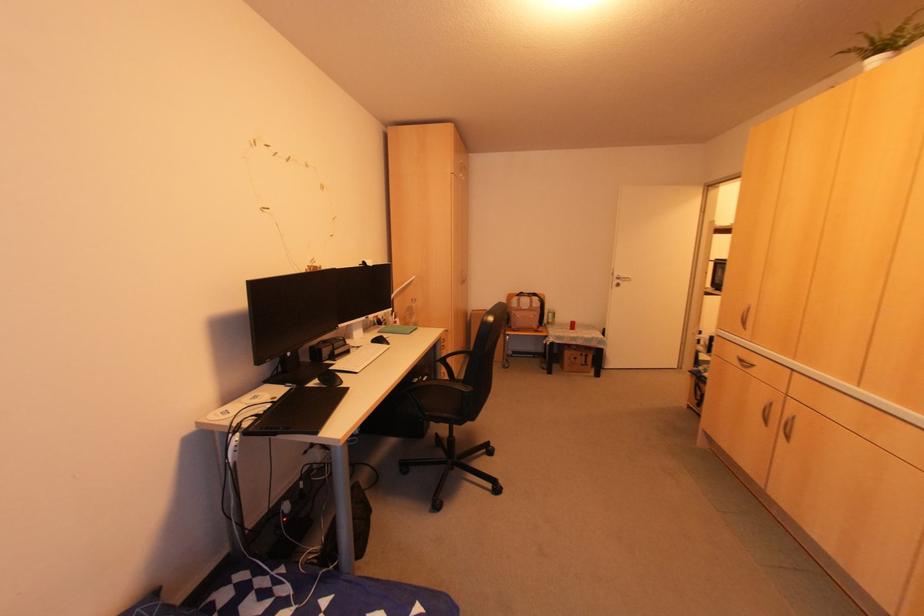
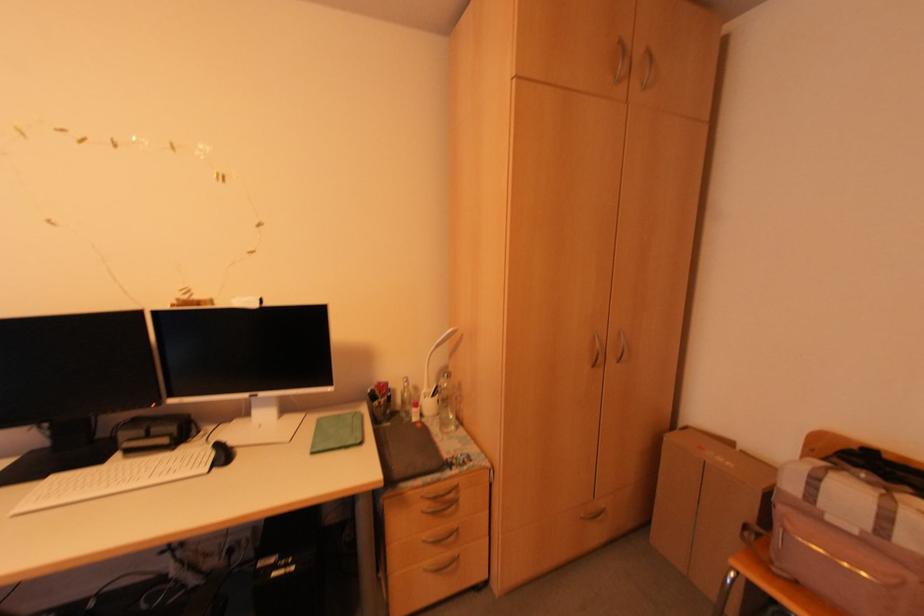
Locate, in the second image, the point that corresponds to point (525, 309) in the first image.

(854, 532)